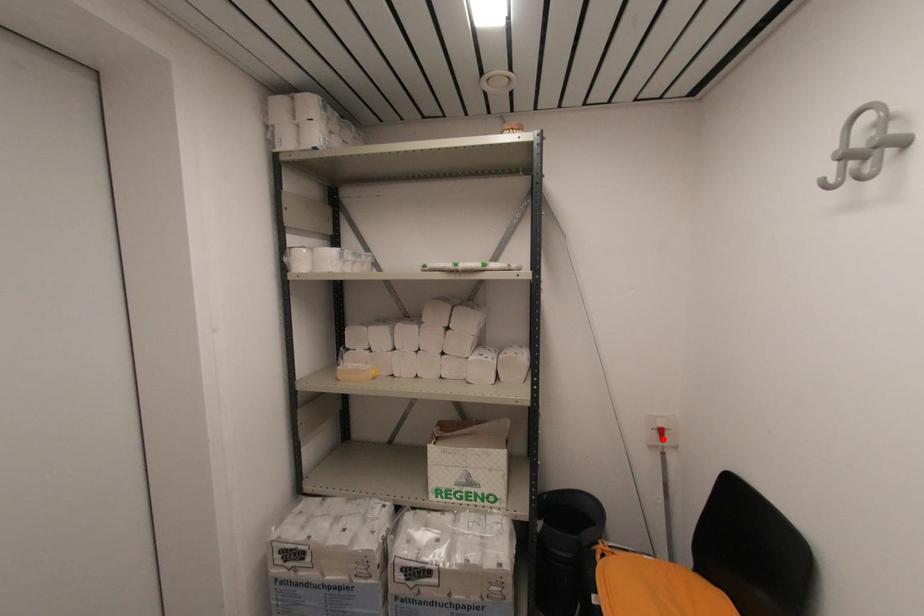
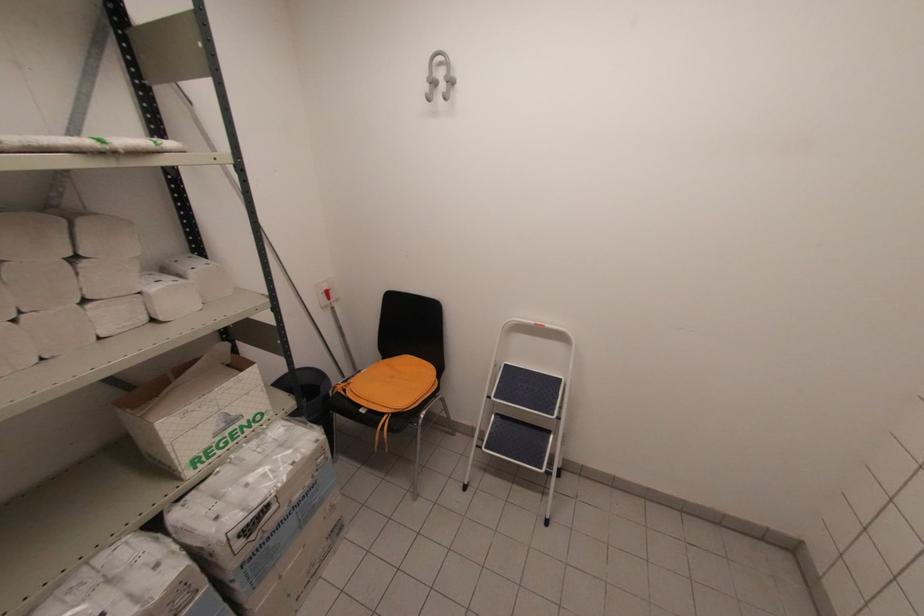
Question: I am providing you with two images of the same scene from different viewpoints. Image1 has a red point marked. In image2, the corresponding 3D location appears at what relative position? Reply with the corresponding letter.

Choices:
 (A) Closer
 (B) Farther

Answer: (A)